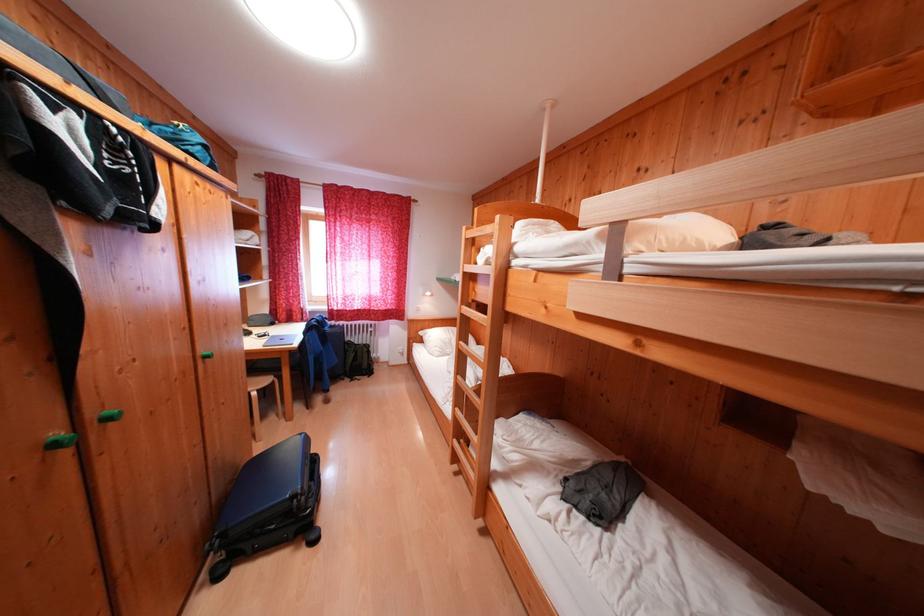
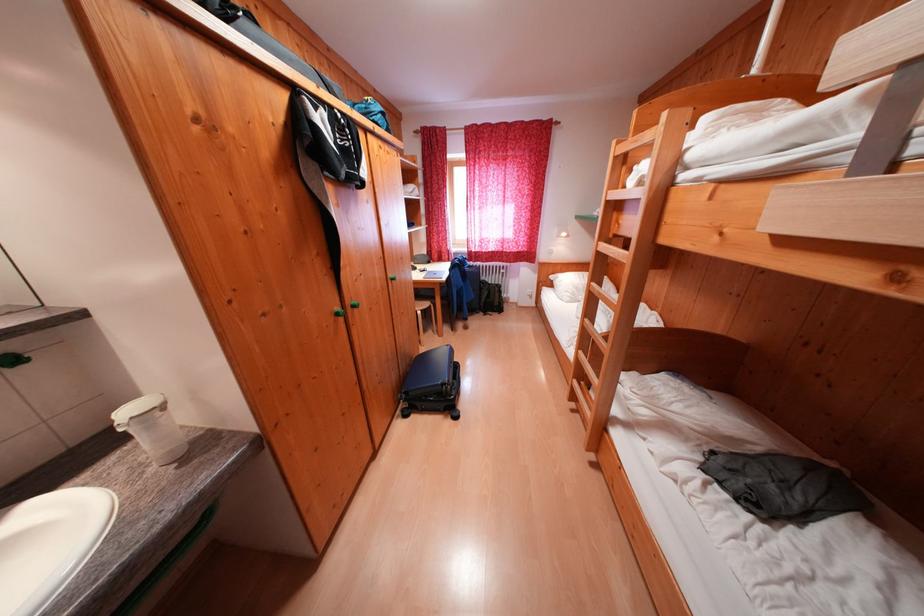
In the second image, find the point that corresponds to the point at 313,337 in the first image.

(458, 274)